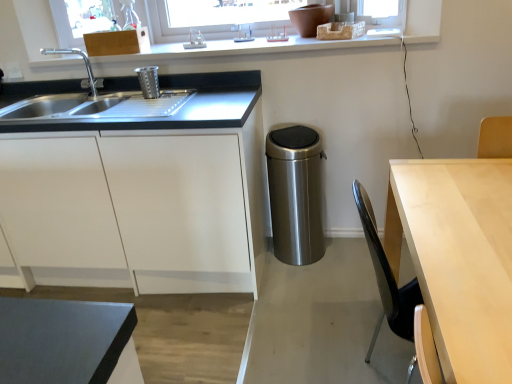
Where is `unoccupied region to the right of stainless steel trash can at center, arranged as the first appliance when ordered from the bottom`? unoccupied region to the right of stainless steel trash can at center, arranged as the first appliance when ordered from the bottom is located at coordinates coord(346,256).